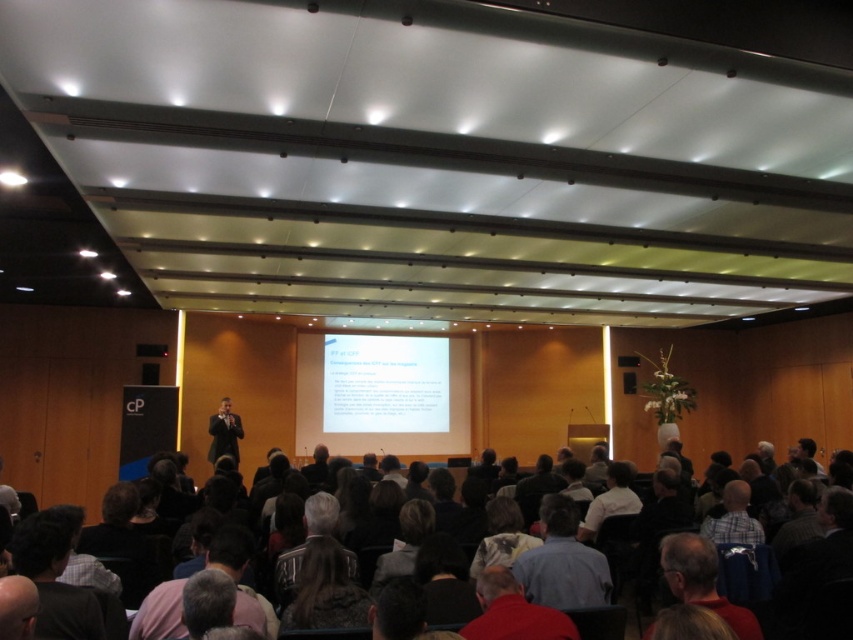
Based on the photo, you are sitting in the audience and want to look at two points on the stage. The first point is at coordinate point (508, 588) and the second is at point (15, 595). Which point is closer to you?

Point (508, 588) is closer to you because it is further to the viewer than point (15, 595).

Based on the photo, you are sitting in the audience and want to know which of the two points, point [135,632] or point [288,588], is closer to you. Based on the scene description, can you determine which one is nearer?

Point [135,632] is closer to the viewer than point [288,588].